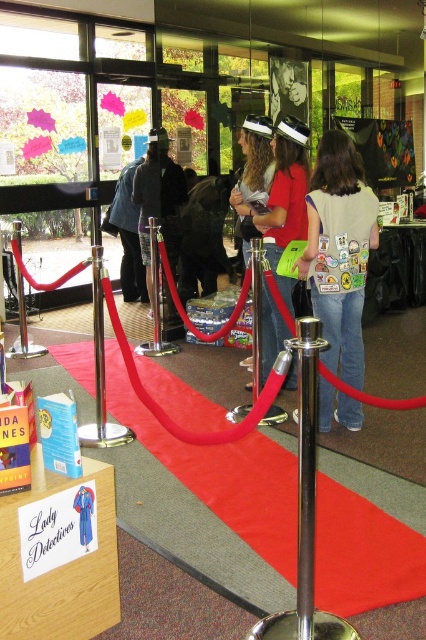
You are a child wearing a dark blue fabric hat at center and want to touch the metallic silver pole at center. Can you reach it if you stretch your arms fully?

The metallic silver pole at center is smaller than the dark blue fabric hat at center, so the pole is shorter than the hat. Since the pole is shorter, it might be at a lower height, making it easier for the child to reach it when stretching their arms.

You are a photographer at the event and need to capture a clear photo of both the red shirt at center and the metallic silver pole at center. Based on their heights, which object should you focus on first to ensure both are in frame?

The red shirt at center is taller than the metallic silver pole at center, so you should focus on the red shirt at center first to ensure both are in frame.

You are organizing a photo shoot and need to place a 1.2 meter wide backdrop between the metallic silver pole at center and the dark blue fabric hat at center. Can the backdrop fit between them?

The metallic silver pole at center is narrower than the dark blue fabric hat at center. However, the exact distance between them isn not specified in the provided information. Without knowing the space between the pole and the hat, it is impossible to determine if the 1.2 meter wide backdrop can fit.